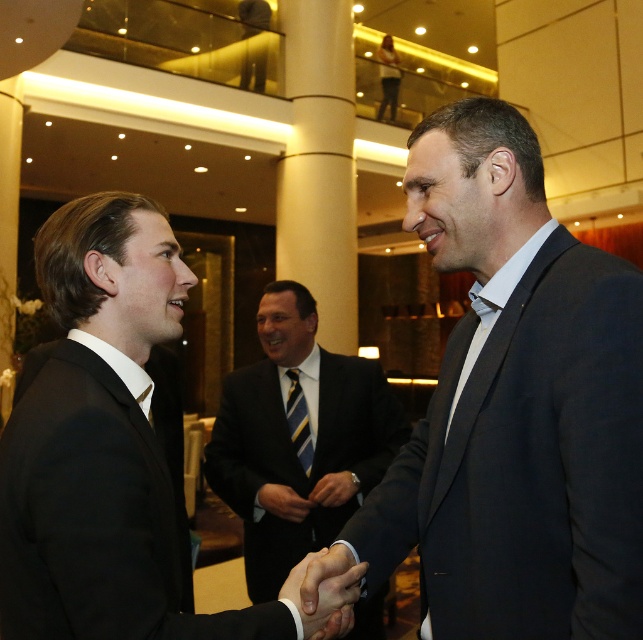
From the picture: You are a photographer at the event and want to capture a photo of the striped silk tie at center without the smooth leather hand at center blocking it. Based on their positions, is this possible?

The smooth leather hand at center is below the striped silk tie at center, so it is possible to capture the striped silk tie at center without the hand blocking it by adjusting the camera angle to focus above the hand.

You are standing in the hotel lobby and want to determine which of the two points, point (x=568, y=396) or point (x=367, y=376), is closer to you. Based on the image, which point is nearer?

Point (x=568, y=396) is closer to the camera than point (x=367, y=376), so it is nearer to you.